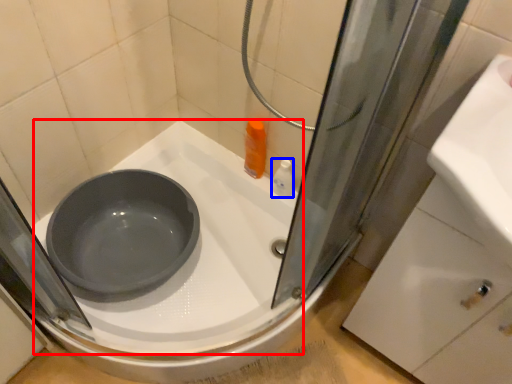
Question: Which object appears farthest to the camera in this image, bath (highlighted by a red box) or toiletry (highlighted by a blue box)?

Choices:
 (A) bath
 (B) toiletry

Answer: (B)